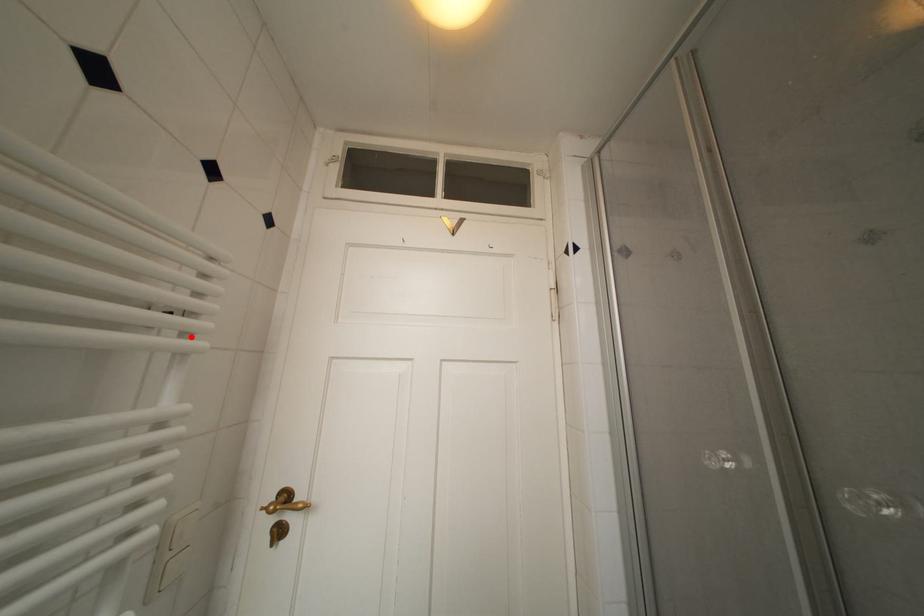
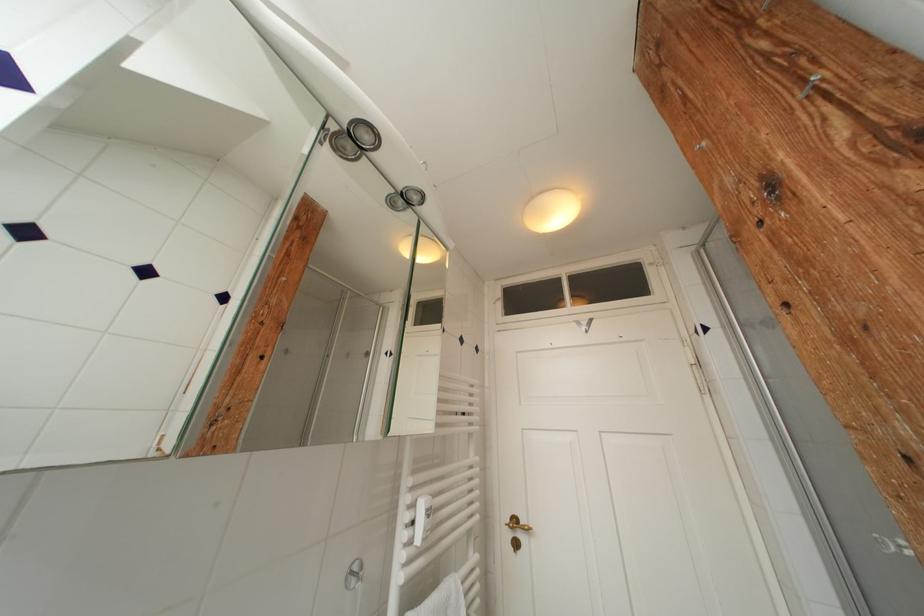
Where in the second image is the point corresponding to the highlighted location from the first image?

(478, 427)